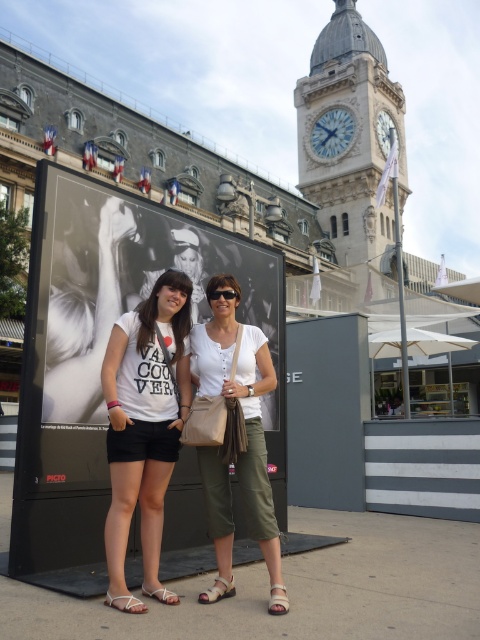
Is point (214, 340) farther from camera compared to point (162, 595)?

Yes, it is.

Does white cotton shirt at center appear over white leather sandal at lower center?

Yes, white cotton shirt at center is above white leather sandal at lower center.

Who is more forward, (212, 394) or (158, 600)?

Point (158, 600) is more forward.

Where is `white cotton shirt at center`? The image size is (480, 640). white cotton shirt at center is located at coordinates (241, 412).

Can you confirm if black glossy poster at center is bigger than white leather sandal at lower left?

Yes, black glossy poster at center is bigger than white leather sandal at lower left.

Which is in front, point (43, 336) or point (128, 605)?

Point (128, 605) is more forward.

What do you see at coordinates (118, 314) in the screenshot? The width and height of the screenshot is (480, 640). I see `black glossy poster at center` at bounding box center [118, 314].

Image resolution: width=480 pixels, height=640 pixels. In order to click on black glossy poster at center in this screenshot , I will do `click(118, 314)`.

Is point (255, 406) farther from viewer compared to point (235, 291)?

No, (255, 406) is in front of (235, 291).

Find the location of `white cotton shirt at center`. white cotton shirt at center is located at coordinates (241, 412).

Which is behind, point (245, 324) or point (225, 291)?

Positioned behind is point (245, 324).

This screenshot has width=480, height=640. Identify the location of white cotton shirt at center. (241, 412).